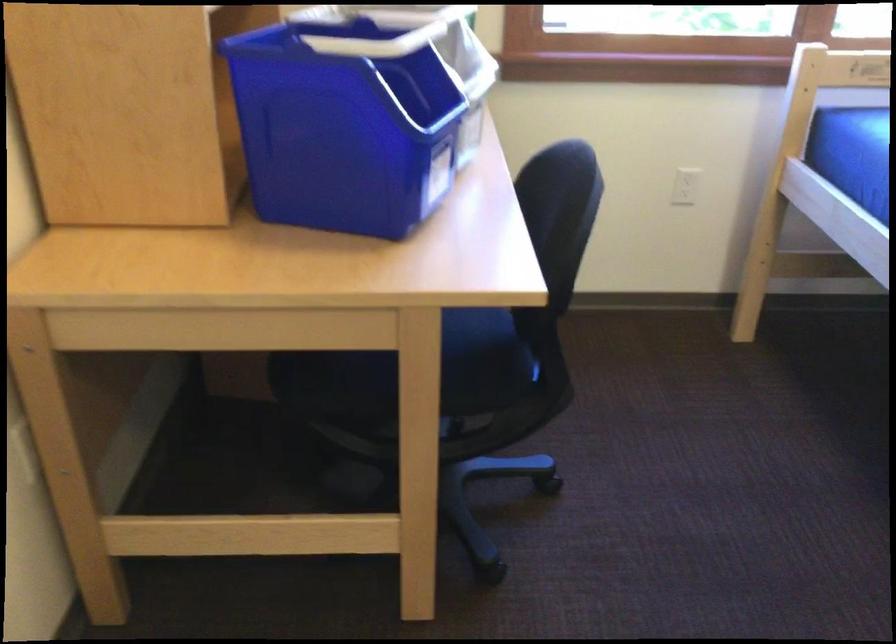
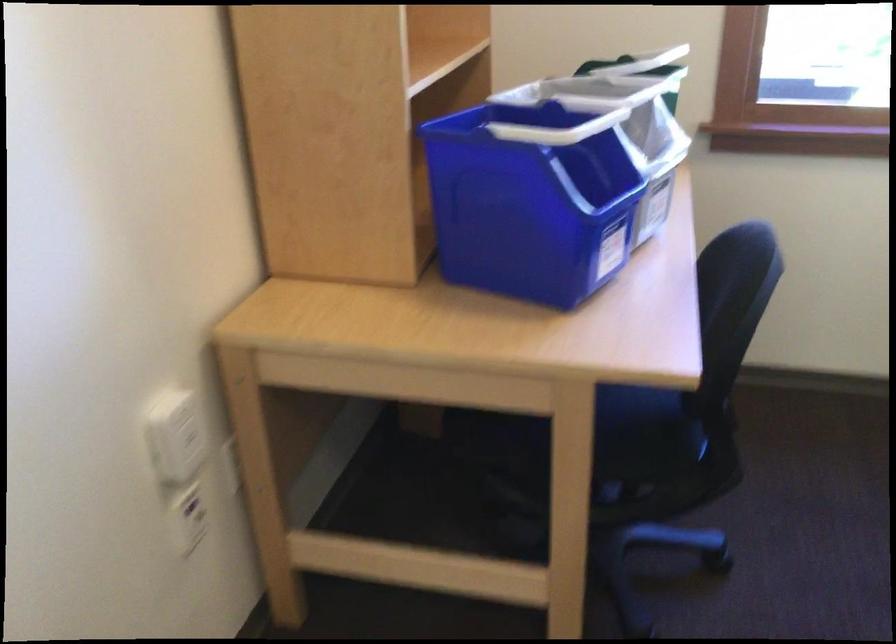
Looking at this image, what movement of the cameraman would produce the second image?

The cameraman moved toward right, backward.